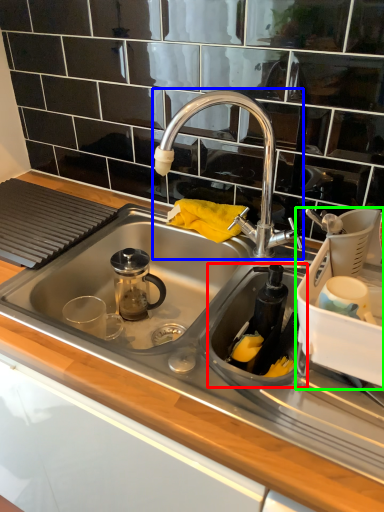
Question: Which is farther away from appliance (highlighted by a red box)? tap (highlighted by a blue box) or appliance (highlighted by a green box)?

Choices:
 (A) tap
 (B) appliance

Answer: (A)